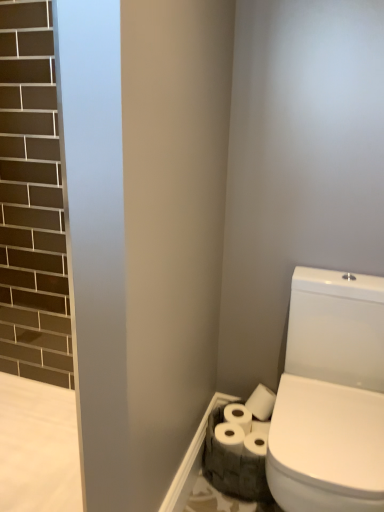
Question: Looking at their shapes, would you say white matte toilet paper at lower right, the 2th toilet paper positioned from the front, is wider or thinner than white matte toilet paper at lower right, positioned as the second toilet paper in back-to-front order?

Choices:
 (A) thin
 (B) wide

Answer: (A)

Question: In the image, is white matte toilet paper at lower right, the 2th toilet paper positioned from the front, on the left side or the right side of white matte toilet paper at lower right, the first toilet paper when ordered from front to back?

Choices:
 (A) right
 (B) left

Answer: (A)

Question: Does point (235, 408) appear closer or farther from the camera than point (233, 422)?

Choices:
 (A) closer
 (B) farther

Answer: (B)

Question: From the image's perspective, is white matte toilet paper at lower right, positioned as the second toilet paper in back-to-front order, above or below white matte toilet paper at lower right, which is counted as the 1th toilet paper, starting from the back?

Choices:
 (A) above
 (B) below

Answer: (B)

Question: Would you say white matte toilet paper at lower right, the first toilet paper when ordered from front to back, is to the left or to the right of white matte toilet paper at lower right, which is counted as the 1th toilet paper, starting from the back, in the picture?

Choices:
 (A) left
 (B) right

Answer: (A)

Question: Considering the positions of white matte toilet paper at lower right, positioned as the second toilet paper in back-to-front order, and white matte toilet paper at lower right, the 2th toilet paper positioned from the front, in the image, is white matte toilet paper at lower right, positioned as the second toilet paper in back-to-front order, taller or shorter than white matte toilet paper at lower right, the 2th toilet paper positioned from the front,?

Choices:
 (A) tall
 (B) short

Answer: (B)

Question: Is white matte toilet paper at lower right, positioned as the second toilet paper in back-to-front order, in front of or behind white matte toilet paper at lower right, which is counted as the 1th toilet paper, starting from the back, in the image?

Choices:
 (A) behind
 (B) front

Answer: (B)